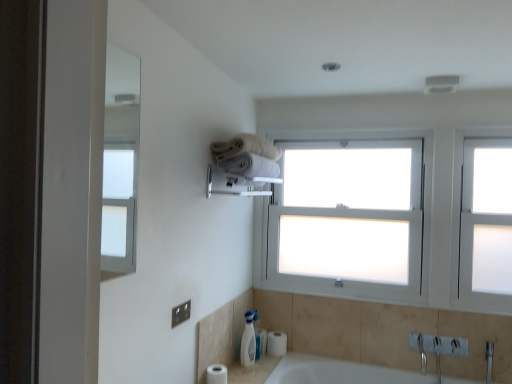
Describe the element at coordinates (349, 208) in the screenshot. This screenshot has width=512, height=384. I see `white frosted glass window at center` at that location.

What do you see at coordinates (276, 343) in the screenshot?
I see `white matte toilet paper at lower center, which is the 1th toilet paper from back to front` at bounding box center [276, 343].

Find the location of a particular element. frosted glass window at right is located at coordinates (485, 227).

The width and height of the screenshot is (512, 384). What do you see at coordinates (437, 348) in the screenshot?
I see `white ceramic sink at lower right` at bounding box center [437, 348].

This screenshot has width=512, height=384. What do you see at coordinates (216, 374) in the screenshot?
I see `white matte toilet paper at lower left, which appears as the 2th toilet paper when viewed from the right` at bounding box center [216, 374].

At what (x,y) coordinates should I click in order to perform the action: click on white frosted glass window at center. Please return your answer as a coordinate pair (x, y). This screenshot has height=384, width=512. Looking at the image, I should click on (349, 208).

Is point (233, 374) less distant than point (236, 146)?

No.

From the image's perspective, which is below, white ceramic sink at lower center or white cotton towel at upper center?

white ceramic sink at lower center appears lower in the image.

How different are the orientations of white ceramic sink at lower center and white cotton towel at upper center in degrees?

white ceramic sink at lower center and white cotton towel at upper center are facing 89.3 degrees away from each other.

From a real-world perspective, is white ceramic sink at lower center on white cotton towel at upper center?

No, from a real-world perspective, white ceramic sink at lower center is not on top of white cotton towel at upper center.

Considering the sizes of objects satin silver towel bar at upper center and white glossy soap dispenser at lower center in the image provided, who is smaller, satin silver towel bar at upper center or white glossy soap dispenser at lower center?

With smaller size is white glossy soap dispenser at lower center.

Is satin silver towel bar at upper center not inside white glossy soap dispenser at lower center?

Yes, satin silver towel bar at upper center is not within white glossy soap dispenser at lower center.

Consider the image. From a real-world perspective, does satin silver towel bar at upper center stand above white glossy soap dispenser at lower center?

Correct, in the physical world, satin silver towel bar at upper center is higher than white glossy soap dispenser at lower center.

Image resolution: width=512 pixels, height=384 pixels. I want to click on towel bar that is on the right side of white glossy soap dispenser at lower center, so click(236, 183).

Based on the photo, from the image's perspective, which one is positioned lower, white matte toilet paper at lower left, which is counted as the 1th toilet paper, starting from the left, or white glossy soap dispenser at lower center?

From the image's view, white matte toilet paper at lower left, which is counted as the 1th toilet paper, starting from the left, is below.

From a real-world perspective, count 2nd toilet papers downward from the white glossy soap dispenser at lower center and point to it. Please provide its 2D coordinates.

[(216, 374)]

Which point is more distant from viewer, (226, 383) or (249, 335)?

The point (249, 335) is farther from the camera.

Can you confirm if white matte toilet paper at lower left, which appears as the 2th toilet paper when viewed from the right, is taller than white glossy soap dispenser at lower center?

No, white matte toilet paper at lower left, which appears as the 2th toilet paper when viewed from the right, is not taller than white glossy soap dispenser at lower center.

Could satin silver towel bar at upper center be considered to be inside white ceramic sink at lower center?

That's incorrect, satin silver towel bar at upper center is not inside white ceramic sink at lower center.

Is white ceramic sink at lower center wider or thinner than satin silver towel bar at upper center?

Clearly, white ceramic sink at lower center has more width compared to satin silver towel bar at upper center.

Does white ceramic sink at lower center have a lesser height compared to satin silver towel bar at upper center?

Correct, white ceramic sink at lower center is not as tall as satin silver towel bar at upper center.

Which is more to the right, white ceramic sink at lower center or satin silver towel bar at upper center?

From the viewer's perspective, white ceramic sink at lower center appears more on the right side.

Is white matte toilet paper at lower left, which is counted as the 1th toilet paper, starting from the left, placed right next to white frosted glass window at center?

No, white matte toilet paper at lower left, which is counted as the 1th toilet paper, starting from the left, is not in contact with white frosted glass window at center.

This screenshot has width=512, height=384. I want to click on window screen behind the white matte toilet paper at lower left, which appears as the 2th toilet paper when viewed from the right, so click(349, 208).

Is white matte toilet paper at lower left, which is counted as the 1th toilet paper, starting from the left, taller than white frosted glass window at center?

Incorrect, the height of white matte toilet paper at lower left, which is counted as the 1th toilet paper, starting from the left, is not larger of that of white frosted glass window at center.

From the image's perspective, which is above, white frosted glass window at center or white ceramic sink at lower center?

white frosted glass window at center, from the image's perspective.

Is white frosted glass window at center not near white ceramic sink at lower center?

white frosted glass window at center is actually quite close to white ceramic sink at lower center.

From a real-world perspective, which is physically above, white frosted glass window at center or white ceramic sink at lower center?

From a 3D spatial view, white frosted glass window at center is above.

The height and width of the screenshot is (384, 512). In the image, there is a white frosted glass window at center. Find the location of `counter top below it (from the image's perspective)`. counter top below it (from the image's perspective) is located at coordinates (252, 371).

Is white matte toilet paper at lower left, the 1th toilet paper viewed from the front, smaller than white ceramic sink at lower center?

Yes, white matte toilet paper at lower left, the 1th toilet paper viewed from the front, is smaller than white ceramic sink at lower center.

Identify the location of counter top on the right of white matte toilet paper at lower left, which is counted as the 1th toilet paper, starting from the left. This screenshot has width=512, height=384. (252, 371).

Considering the relative sizes of white matte toilet paper at lower left, which is counted as the 1th toilet paper, starting from the left, and white ceramic sink at lower center in the image provided, is white matte toilet paper at lower left, which is counted as the 1th toilet paper, starting from the left, wider than white ceramic sink at lower center?

In fact, white matte toilet paper at lower left, which is counted as the 1th toilet paper, starting from the left, might be narrower than white ceramic sink at lower center.

Identify the location of counter top lying below the white cotton towel at upper center (from the image's perspective). (252, 371).

Locate an element on the screen. The image size is (512, 384). soap dispenser below the satin silver towel bar at upper center (from a real-world perspective) is located at coordinates (248, 341).

Looking at the image, which one is located further to white matte toilet paper at lower left, the 1th toilet paper viewed from the front, white frosted glass window at center or white glossy soap dispenser at lower center?

white frosted glass window at center is positioned further to the anchor white matte toilet paper at lower left, the 1th toilet paper viewed from the front.

Looking at the image, which one is located closer to white matte toilet paper at lower left, the 1th toilet paper viewed from the front, white matte toilet paper at lower center, which is the 1th toilet paper from back to front, or frosted glass window at right?

Based on the image, white matte toilet paper at lower center, which is the 1th toilet paper from back to front, appears to be nearer to white matte toilet paper at lower left, the 1th toilet paper viewed from the front.

Estimate the real-world distances between objects in this image. Which object is closer to white frosted glass window at center, white matte toilet paper at lower left, the 2th toilet paper viewed from the back, or white ceramic sink at lower right?

white ceramic sink at lower right lies closer to white frosted glass window at center than the other object.

Considering their positions, is satin silver towel bar at upper center positioned closer to frosted glass window at right than white matte toilet paper at lower center, which is the 1th toilet paper from right to left?

The object closer to frosted glass window at right is satin silver towel bar at upper center.

Looking at the image, which one is located further to white ceramic sink at lower center, white glossy soap dispenser at lower center or satin silver towel bar at upper center?

satin silver towel bar at upper center lies further to white ceramic sink at lower center than the other object.

Considering their positions, is frosted glass window at right positioned further to white ceramic sink at lower right than white glossy soap dispenser at lower center?

white glossy soap dispenser at lower center is further to white ceramic sink at lower right.

Based on their spatial positions, is white matte toilet paper at lower center, which is the 1th toilet paper from back to front, or white cotton towel at upper center further from white frosted glass window at center?

Based on the image, white matte toilet paper at lower center, which is the 1th toilet paper from back to front, appears to be further to white frosted glass window at center.

When comparing their distances from white matte toilet paper at lower center, which ranks as the 2th toilet paper in front-to-back order, does frosted glass window at right or white ceramic sink at lower right seem further?

frosted glass window at right.

The image size is (512, 384). I want to click on window screen between satin silver towel bar at upper center and frosted glass window at right in the horizontal direction, so click(349, 208).

At what (x,y) coordinates should I click in order to perform the action: click on sink between white cotton towel at upper center and frosted glass window at right in the horizontal direction. Please return your answer as a coordinate pair (x, y). This screenshot has width=512, height=384. Looking at the image, I should click on (437, 348).

Locate an element on the screen. The width and height of the screenshot is (512, 384). counter top situated between white matte toilet paper at lower left, the 2th toilet paper viewed from the back, and frosted glass window at right from left to right is located at coordinates (252, 371).

Image resolution: width=512 pixels, height=384 pixels. I want to click on window screen that lies between white cotton towel at upper center and white matte toilet paper at lower center, which ranks as the 2th toilet paper in front-to-back order, from top to bottom, so click(x=349, y=208).